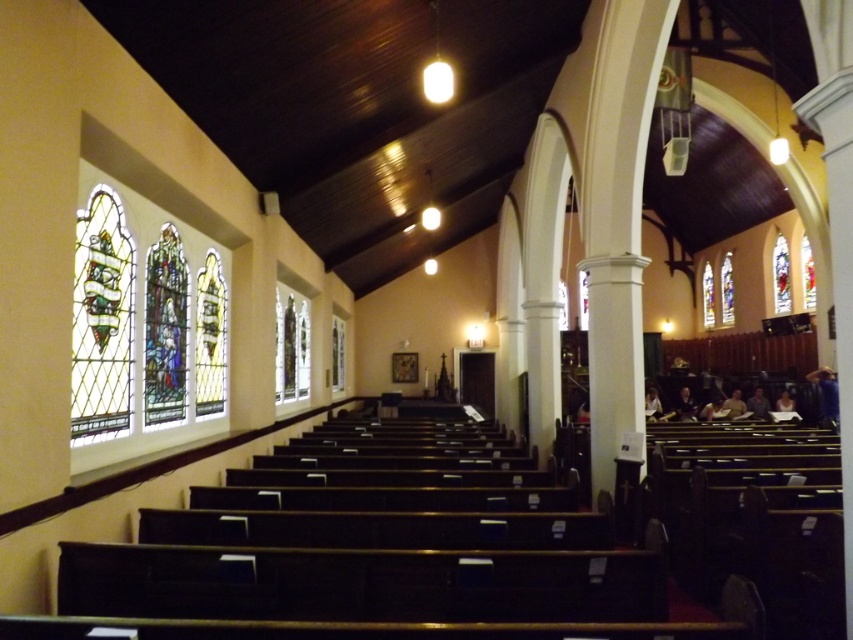
Question: Which object is the farthest from the stained glass at left?

Choices:
 (A) stained glass window at right
 (B) stained glass window at left

Answer: (A)

Question: From the image, what is the correct spatial relationship of stained glass window at left in relation to stained glass window at right?

Choices:
 (A) below
 (B) above

Answer: (A)

Question: Is stained glass at left closer to camera compared to stained glass window at left?

Choices:
 (A) yes
 (B) no

Answer: (A)

Question: Does stained glass at left have a larger size compared to stained glass window at left?

Choices:
 (A) yes
 (B) no

Answer: (A)

Question: Estimate the real-world distances between objects in this image. Which object is farther from the stained glass at left?

Choices:
 (A) stained glass window at right
 (B) stained glass window at left

Answer: (A)

Question: Based on their relative distances, which object is farther from the stained glass window at right?

Choices:
 (A) stained glass window at left
 (B) stained glass at left

Answer: (A)